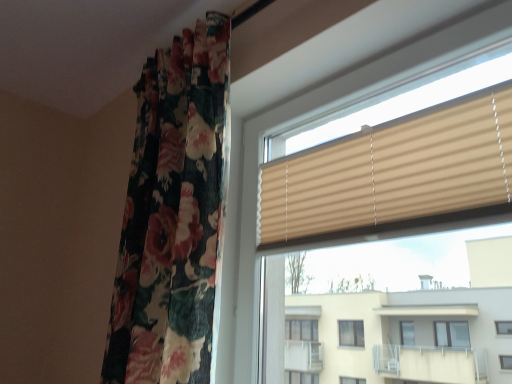
Question: Does beige ribbed blinds at center have a greater width compared to beige ribbed blind at upper right?

Choices:
 (A) no
 (B) yes

Answer: (B)

Question: Is the position of beige ribbed blinds at center less distant than that of beige ribbed blind at upper right?

Choices:
 (A) yes
 (B) no

Answer: (A)

Question: Is beige ribbed blinds at center oriented towards beige ribbed blind at upper right?

Choices:
 (A) yes
 (B) no

Answer: (A)

Question: Is beige ribbed blinds at center positioned behind beige ribbed blind at upper right?

Choices:
 (A) yes
 (B) no

Answer: (B)

Question: From a real-world perspective, does beige ribbed blinds at center sit lower than beige ribbed blind at upper right?

Choices:
 (A) no
 (B) yes

Answer: (B)

Question: Is beige ribbed blinds at center taller than beige ribbed blind at upper right?

Choices:
 (A) no
 (B) yes

Answer: (B)

Question: From a real-world perspective, is beige ribbed blind at upper right located higher than beige ribbed blinds at center?

Choices:
 (A) yes
 (B) no

Answer: (A)

Question: Does beige ribbed blind at upper right have a greater height compared to beige ribbed blinds at center?

Choices:
 (A) yes
 (B) no

Answer: (B)

Question: Is beige ribbed blind at upper right at the left side of beige ribbed blinds at center?

Choices:
 (A) no
 (B) yes

Answer: (A)

Question: Does beige ribbed blind at upper right have a lesser height compared to beige ribbed blinds at center?

Choices:
 (A) yes
 (B) no

Answer: (A)

Question: Is beige ribbed blind at upper right bigger than beige ribbed blinds at center?

Choices:
 (A) yes
 (B) no

Answer: (B)

Question: Is beige ribbed blind at upper right to the right of beige ribbed blinds at center from the viewer's perspective?

Choices:
 (A) yes
 (B) no

Answer: (A)

Question: From a real-world perspective, is beige ribbed blind at upper right under floral fabric curtain at left?

Choices:
 (A) no
 (B) yes

Answer: (B)